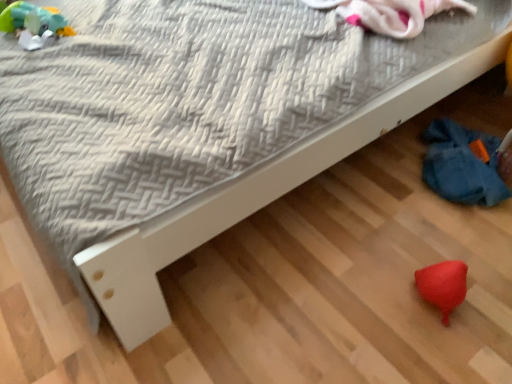
Locate an element on the screen. This screenshot has width=512, height=384. rubberized green and yellow toy at upper left is located at coordinates (34, 20).

What do you see at coordinates (34, 20) in the screenshot?
I see `rubberized green and yellow toy at upper left` at bounding box center [34, 20].

Identify the location of rubberized green and yellow toy at upper left. (34, 20).